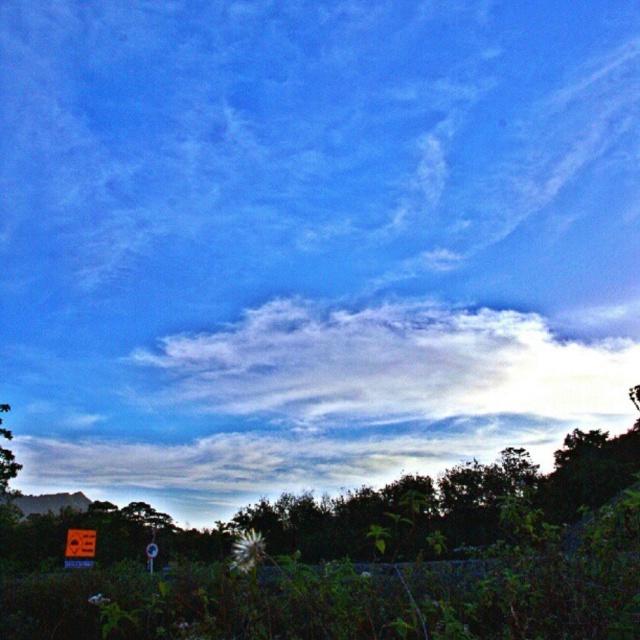
Does metallic red sign at bottom left have a smaller size compared to metallic reflective sign at lower left?

Yes, metallic red sign at bottom left is smaller than metallic reflective sign at lower left.

Looking at this image, is metallic red sign at bottom left taller than metallic reflective sign at lower left?

No.

Is point (92, 545) positioned before point (148, 561)?

That is False.

I want to click on metallic red sign at bottom left, so click(x=80, y=547).

Does white fluffy cloud at center appear over metallic red sign at bottom left?

Indeed, white fluffy cloud at center is positioned over metallic red sign at bottom left.

Looking at this image, is white fluffy cloud at center wider than metallic red sign at bottom left?

Correct, the width of white fluffy cloud at center exceeds that of metallic red sign at bottom left.

Is point (547, 376) behind point (81, 561)?

Yes, it is.

Image resolution: width=640 pixels, height=640 pixels. Find the location of `white fluffy cloud at center`. white fluffy cloud at center is located at coordinates (394, 364).

Does white fluffy cloud at center come behind metallic reflective sign at lower left?

Yes, white fluffy cloud at center is behind metallic reflective sign at lower left.

Between point (600, 412) and point (154, 557), which one is positioned in front?

Point (154, 557)

You are a GUI agent. You are given a task and a screenshot of the screen. Output one action in this format:
    pyautogui.click(x=<x>, y=<y>)
    Task: Click on the white fluffy cloud at center
    The height and width of the screenshot is (640, 640).
    Given the screenshot: What is the action you would take?
    pyautogui.click(x=394, y=364)